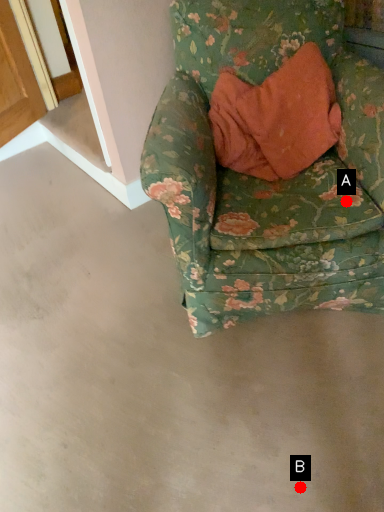
Question: Two points are circled on the image, labeled by A and B beside each circle. Which point is closer to the camera?

Choices:
 (A) A is closer
 (B) B is closer

Answer: (B)